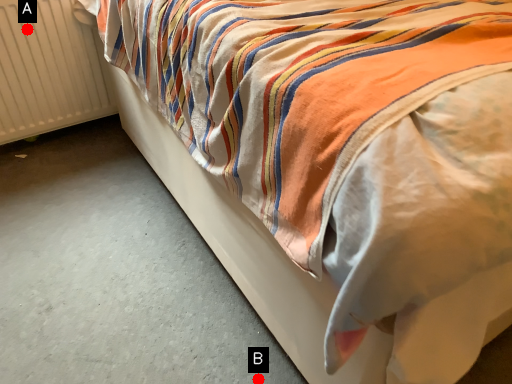
Question: Two points are circled on the image, labeled by A and B beside each circle. Which point appears farthest from the camera in this image?

Choices:
 (A) A is further
 (B) B is further

Answer: (A)